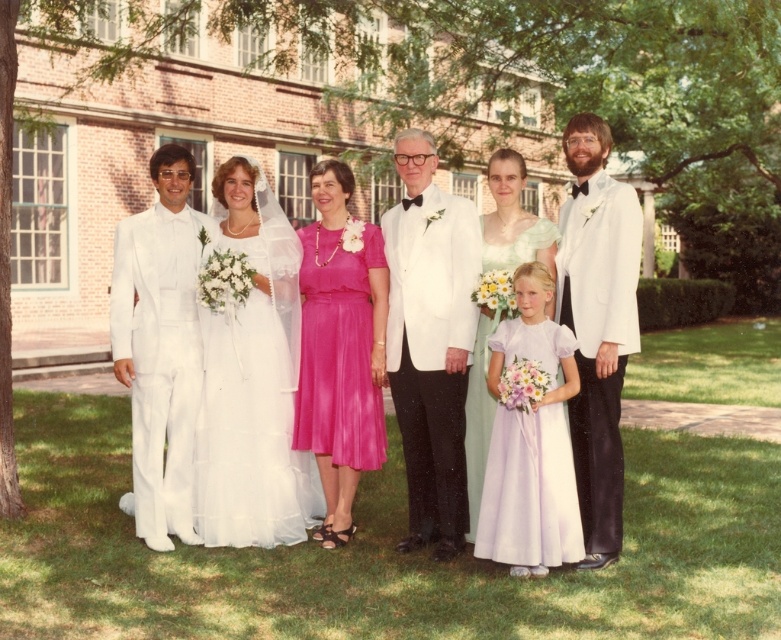
Question: Which object appears closest to the camera in this image?

Choices:
 (A) white tulle dress at center
 (B) white satin tuxedo at center
 (C) pink satin dress at center

Answer: (B)

Question: Among these objects, which one is nearest to the camera?

Choices:
 (A) white satin tuxedo at right
 (B) white satin tuxedo at center
 (C) light green satin dress at center
 (D) lavender satin dress at center

Answer: (D)

Question: Is white satin tuxedo at center above pink satin dress at center?

Choices:
 (A) no
 (B) yes

Answer: (B)

Question: Can you confirm if green grass at center is positioned above white satin dress at center?

Choices:
 (A) no
 (B) yes

Answer: (A)

Question: Which point appears farthest from the camera in this image?

Choices:
 (A) (601, 304)
 (B) (280, 291)
 (C) (159, 525)

Answer: (B)

Question: From the image, what is the correct spatial relationship of white satin tuxedo at center in relation to white satin tuxedo at right?

Choices:
 (A) right
 (B) left

Answer: (B)